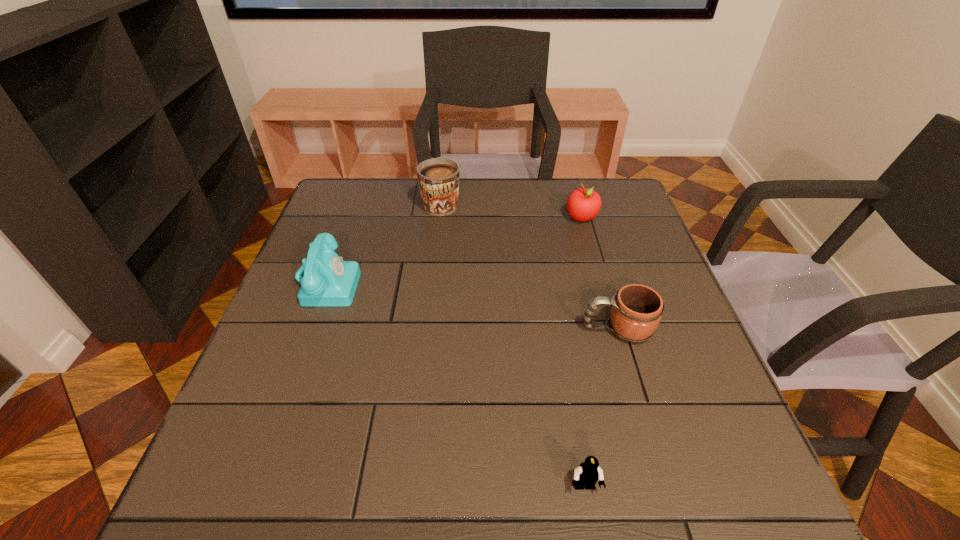
Locate an element on the screen. the fourth object from right to left is located at coordinates (438, 178).

The width and height of the screenshot is (960, 540). I want to click on the left mug, so click(x=438, y=178).

You are a GUI agent. You are given a task and a screenshot of the screen. Output one action in this format:
    pyautogui.click(x=<x>, y=<y>)
    Task: Click on the telephone
    Image resolution: width=960 pixels, height=540 pixels.
    Given the screenshot: What is the action you would take?
    pos(329,281)

This screenshot has height=540, width=960. Find the location of `apple`. apple is located at coordinates (583, 204).

Find the location of a particular element. This screenshot has height=540, width=960. the nearer mug is located at coordinates (636, 310).

At what (x,y) coordinates should I click in order to perform the action: click on the right mug. Please return your answer as a coordinate pair (x, y). The height and width of the screenshot is (540, 960). Looking at the image, I should click on (636, 310).

This screenshot has height=540, width=960. I want to click on the third object from left to right, so click(587, 474).

Where is `Lego`? Image resolution: width=960 pixels, height=540 pixels. Lego is located at coordinates (587, 474).

Image resolution: width=960 pixels, height=540 pixels. I want to click on free space located on the dial of the leftmost object, so click(517, 282).

Where is `blank space located 0.390m on the left of the apple`? This screenshot has width=960, height=540. blank space located 0.390m on the left of the apple is located at coordinates (430, 218).